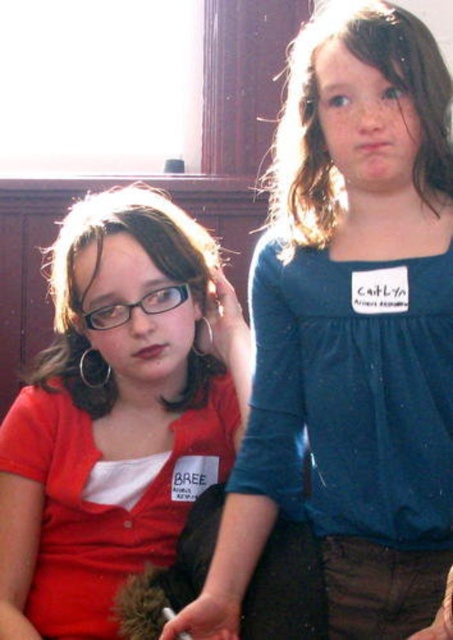
Question: Does matte blue shirt at upper right come in front of matte red shirt at left?

Choices:
 (A) yes
 (B) no

Answer: (A)

Question: Is matte blue shirt at upper right thinner than matte red shirt at left?

Choices:
 (A) yes
 (B) no

Answer: (A)

Question: Which point appears closest to the camera in this image?

Choices:
 (A) (337, 406)
 (B) (178, 339)

Answer: (A)

Question: Considering the relative positions of matte blue shirt at upper right and matte red shirt at left in the image provided, where is matte blue shirt at upper right located with respect to matte red shirt at left?

Choices:
 (A) left
 (B) right

Answer: (B)